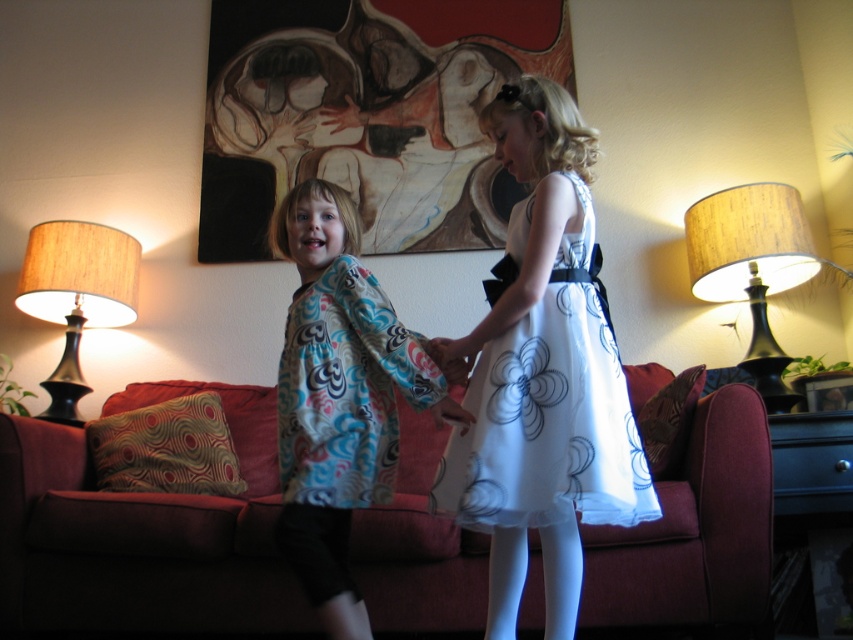
You are a painter who wants to hang a new artwork that is the same size as the painted canvas at upper center. The matte floral kimono at center is currently occupying the space where you want to hang it. Can you hang the new artwork in the same spot without moving the kimono?

The painted canvas at upper center is much taller than the matte floral kimono at center. Since the kimono is shorter, hanging the new artwork which is as tall as the original canvas would require more vertical space than the kimono currently occupies. Therefore, you cannot hang the new artwork in the same spot without moving the kimono.

What are the coordinates of the matte floral kimono at center?

The coordinates of the matte floral kimono at center are at point (x=339, y=396).